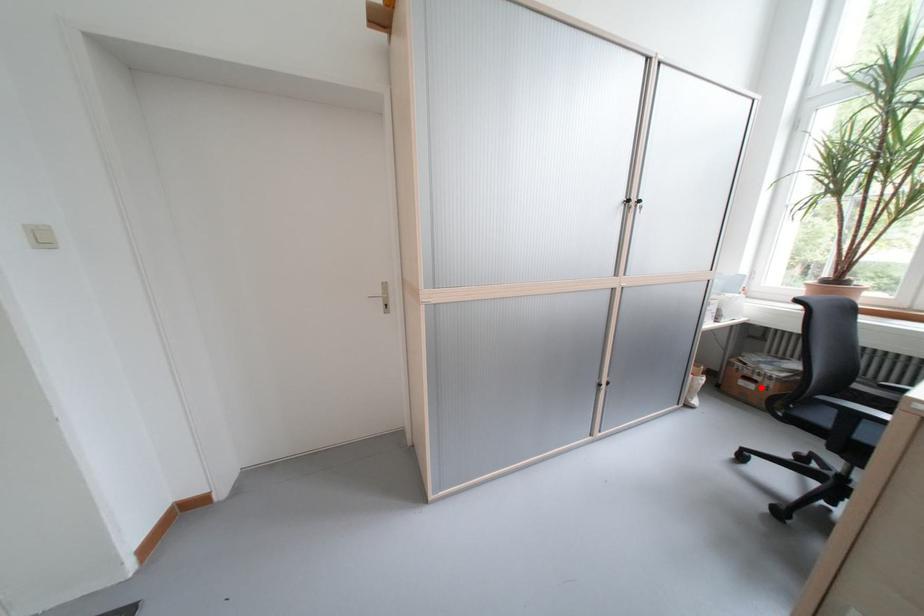
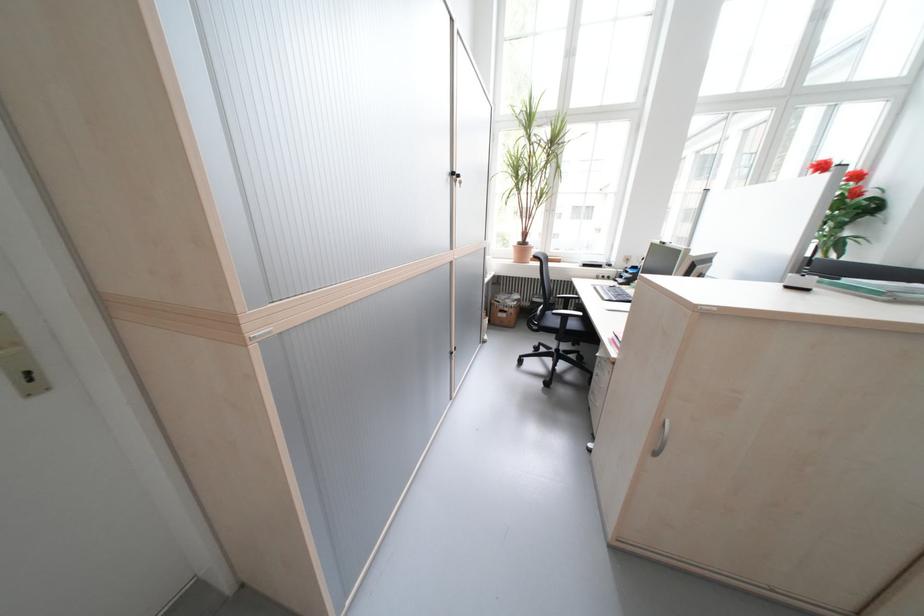
Locate, in the second image, the point that corresponds to the highlighted location in the first image.

(515, 315)